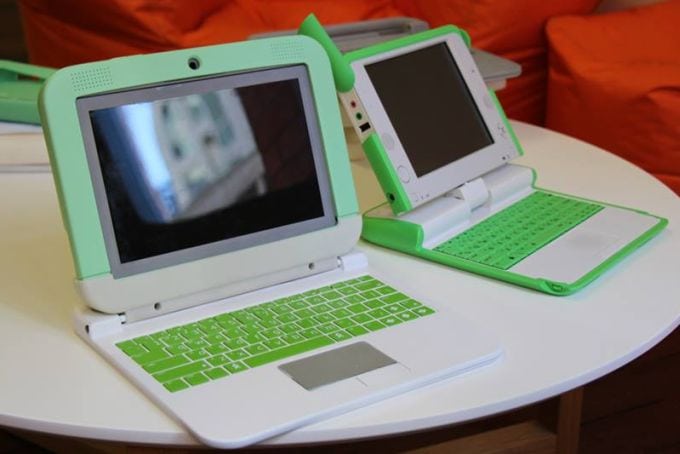
Where is `round table top`? The height and width of the screenshot is (454, 680). round table top is located at coordinates (540, 318).